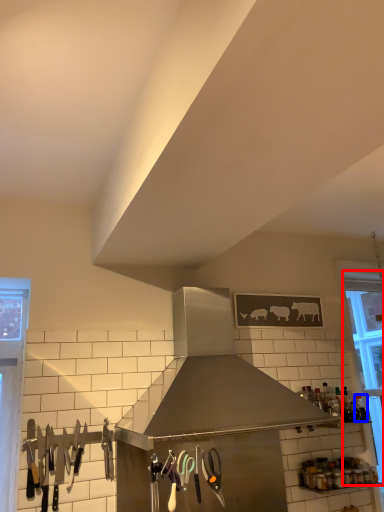
Question: Which point is further to the camera, window (highlighted by a red box) or bottle (highlighted by a blue box)?

Choices:
 (A) window
 (B) bottle

Answer: (A)